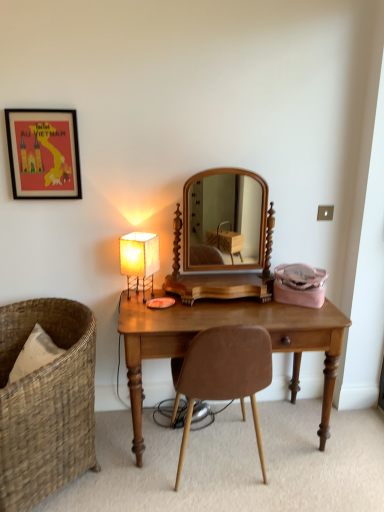
The width and height of the screenshot is (384, 512). What do you see at coordinates (223, 325) in the screenshot? I see `wooden desk at center` at bounding box center [223, 325].

Find the location of a particular element. Image resolution: width=384 pixels, height=512 pixels. woven brown chair at left, the first chair viewed from the left is located at coordinates (46, 403).

In order to face matte black picture frame at upper left, should I rotate leftwards or rightwards?

Turn left approximately 18.972 degrees to face it.

You are a GUI agent. You are given a task and a screenshot of the screen. Output one action in this format:
    pyautogui.click(x=<x>, y=<y>)
    Task: Click on the brown leather chair at center, which ranks as the 1th chair in right-to-left order
    This screenshot has height=512, width=384.
    Given the screenshot: What is the action you would take?
    pyautogui.click(x=224, y=374)

Image resolution: width=384 pixels, height=512 pixels. Find the location of `white paper lampshade at left`. white paper lampshade at left is located at coordinates (139, 260).

Locate an element on the screen. Image resolution: width=384 pixels, height=512 pixels. picture frame above the white paper lampshade at left (from the image's perspective) is located at coordinates (43, 153).

From the image's perspective, is matte black picture frame at upper left below white paper lampshade at left?

Incorrect, from the image's perspective, matte black picture frame at upper left is higher than white paper lampshade at left.

Considering the relative positions of matte black picture frame at upper left and white paper lampshade at left in the image provided, is matte black picture frame at upper left to the left of white paper lampshade at left from the viewer's perspective?

Yes.

From a real-world perspective, between matte black picture frame at upper left and white paper lampshade at left, who is vertically lower?

In real-world perspective, white paper lampshade at left is lower.

Considering the relative sizes of wooden desk at center and white paper lampshade at left in the image provided, is wooden desk at center shorter than white paper lampshade at left?

No.

Could you tell me if wooden desk at center is facing white paper lampshade at left?

No.

Considering the sizes of objects wooden desk at center and white paper lampshade at left in the image provided, who is smaller, wooden desk at center or white paper lampshade at left?

With smaller size is white paper lampshade at left.

The width and height of the screenshot is (384, 512). I want to click on lamp lying on the left of wooden desk at center, so click(139, 260).

In the image, is woven brown chair at left, the 2th chair in the right-to-left sequence, on the left side or the right side of brown leather chair at center, which ranks as the 1th chair in right-to-left order?

Based on their positions, woven brown chair at left, the 2th chair in the right-to-left sequence, is located to the left of brown leather chair at center, which ranks as the 1th chair in right-to-left order.

Is woven brown chair at left, the 2th chair in the right-to-left sequence, bigger than brown leather chair at center, which ranks as the 1th chair in right-to-left order?

Yes.

From a real-world perspective, is woven brown chair at left, the first chair viewed from the left, below brown leather chair at center, which is the second chair in left-to-right order?

Yes, from a real-world perspective, woven brown chair at left, the first chair viewed from the left, is under brown leather chair at center, which is the second chair in left-to-right order.

How much distance is there between woven brown chair at left, the first chair viewed from the left, and brown leather chair at center, which ranks as the 1th chair in right-to-left order?

woven brown chair at left, the first chair viewed from the left, and brown leather chair at center, which ranks as the 1th chair in right-to-left order, are 23.86 inches apart from each other.

Is point (36, 155) in front of point (226, 353)?

No, it is not.

Which is more to the left, matte black picture frame at upper left or brown leather chair at center, which ranks as the 1th chair in right-to-left order?

From the viewer's perspective, matte black picture frame at upper left appears more on the left side.

Is matte black picture frame at upper left oriented towards brown leather chair at center, which is the second chair in left-to-right order?

No, matte black picture frame at upper left is not oriented towards brown leather chair at center, which is the second chair in left-to-right order.

Is the surface of matte black picture frame at upper left in direct contact with brown leather chair at center, which is the second chair in left-to-right order?

No, matte black picture frame at upper left is not making contact with brown leather chair at center, which is the second chair in left-to-right order.

In order to click on picture frame behind the brown leather chair at center, which is the second chair in left-to-right order in this screenshot , I will do `click(43, 153)`.

Is brown leather chair at center, which is the second chair in left-to-right order, not close to matte black picture frame at upper left?

Yes, brown leather chair at center, which is the second chair in left-to-right order, and matte black picture frame at upper left are quite far apart.

Between point (262, 372) and point (26, 150), which one is positioned in front?

The point (262, 372) is closer to the camera.

From a real-world perspective, is brown leather chair at center, which is the second chair in left-to-right order, on top of matte black picture frame at upper left?

Actually, brown leather chair at center, which is the second chair in left-to-right order, is physically below matte black picture frame at upper left in the real world.

From a real-world perspective, is matte black picture frame at upper left located beneath woven brown chair at left, the first chair viewed from the left?

Incorrect, from a real-world perspective, matte black picture frame at upper left is higher than woven brown chair at left, the first chair viewed from the left.

From the image's perspective, is matte black picture frame at upper left located above or below woven brown chair at left, the first chair viewed from the left?

Clearly, from the image's perspective, matte black picture frame at upper left is above woven brown chair at left, the first chair viewed from the left.

Which point is more forward, (78, 152) or (25, 397)?

The point (25, 397) is closer.

Considering the sizes of objects matte black picture frame at upper left and woven brown chair at left, the 2th chair in the right-to-left sequence, in the image provided, who is taller, matte black picture frame at upper left or woven brown chair at left, the 2th chair in the right-to-left sequence,?

woven brown chair at left, the 2th chair in the right-to-left sequence, is taller.

Looking at this image, from the image's perspective, which is below, white paper lampshade at left or wooden desk at center?

wooden desk at center appears lower in the image.

Considering the relative sizes of white paper lampshade at left and wooden desk at center in the image provided, is white paper lampshade at left wider than wooden desk at center?

Incorrect, the width of white paper lampshade at left does not surpass that of wooden desk at center.

How many degrees apart are the facing directions of white paper lampshade at left and wooden desk at center?

The angular difference between white paper lampshade at left and wooden desk at center is 59.7 degrees.

Considering the relative positions of white paper lampshade at left and wooden desk at center in the image provided, is white paper lampshade at left to the left of wooden desk at center from the viewer's perspective?

Yes.

Where is `lamp on the right of the matte black picture frame at upper left`? lamp on the right of the matte black picture frame at upper left is located at coordinates (139, 260).

The width and height of the screenshot is (384, 512). What are the coordinates of `lamp on the left of wooden desk at center` in the screenshot? It's located at (139, 260).

Estimate the real-world distances between objects in this image. Which object is closer to matte black picture frame at upper left, wooden desk at center or woven brown chair at left, the first chair viewed from the left?

woven brown chair at left, the first chair viewed from the left.

When comparing their distances from woven brown chair at left, the first chair viewed from the left, does matte black picture frame at upper left or brown leather chair at center, which ranks as the 1th chair in right-to-left order, seem further?

matte black picture frame at upper left.

Estimate the real-world distances between objects in this image. Which object is further from woven brown chair at left, the 2th chair in the right-to-left sequence, brown leather chair at center, which is the second chair in left-to-right order, or wooden desk at center?

brown leather chair at center, which is the second chair in left-to-right order.

Which object lies further to the anchor point wooden desk at center, matte black picture frame at upper left or white paper lampshade at left?

matte black picture frame at upper left is further to wooden desk at center.

Considering their positions, is brown leather chair at center, which ranks as the 1th chair in right-to-left order, positioned further to wooden desk at center than woven brown chair at left, the first chair viewed from the left?

woven brown chair at left, the first chair viewed from the left.

Based on their spatial positions, is white paper lampshade at left or matte black picture frame at upper left further from brown leather chair at center, which ranks as the 1th chair in right-to-left order?

matte black picture frame at upper left lies further to brown leather chair at center, which ranks as the 1th chair in right-to-left order, than the other object.

When comparing their distances from brown leather chair at center, which is the second chair in left-to-right order, does wooden desk at center or white paper lampshade at left seem closer?

wooden desk at center is positioned closer to the anchor brown leather chair at center, which is the second chair in left-to-right order.

From the image, which object appears to be farther from wooden desk at center, woven brown chair at left, the first chair viewed from the left, or matte black picture frame at upper left?

matte black picture frame at upper left.

Identify the location of lamp between matte black picture frame at upper left and wooden desk at center in the vertical direction. The image size is (384, 512). (139, 260).

What are the coordinates of `desk between white paper lampshade at left and brown leather chair at center, which ranks as the 1th chair in right-to-left order, from top to bottom` in the screenshot? It's located at (223, 325).

Where is `chair that lies between matte black picture frame at upper left and woven brown chair at left, the first chair viewed from the left, from top to bottom`? chair that lies between matte black picture frame at upper left and woven brown chair at left, the first chair viewed from the left, from top to bottom is located at coordinates (224, 374).

Find the location of `lamp between matte black picture frame at upper left and brown leather chair at center, which ranks as the 1th chair in right-to-left order, in the vertical direction`. lamp between matte black picture frame at upper left and brown leather chair at center, which ranks as the 1th chair in right-to-left order, in the vertical direction is located at coordinates (139, 260).